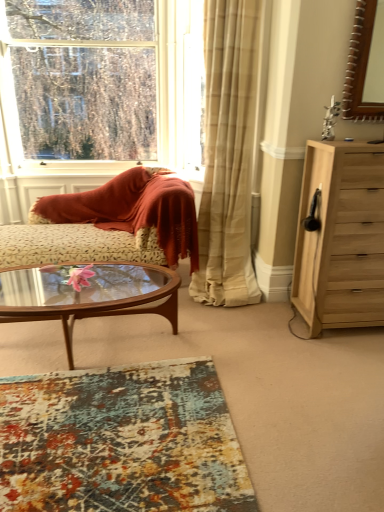
Question: Is textured multicolored rug at lower center next to transparent glass coffee table at center?

Choices:
 (A) no
 (B) yes

Answer: (A)

Question: Is textured multicolored rug at lower center at the left side of transparent glass coffee table at center?

Choices:
 (A) yes
 (B) no

Answer: (B)

Question: From the image's perspective, is textured multicolored rug at lower center beneath transparent glass coffee table at center?

Choices:
 (A) no
 (B) yes

Answer: (B)

Question: Does textured multicolored rug at lower center have a smaller size compared to transparent glass coffee table at center?

Choices:
 (A) yes
 (B) no

Answer: (A)

Question: Considering the relative sizes of textured multicolored rug at lower center and transparent glass coffee table at center in the image provided, is textured multicolored rug at lower center shorter than transparent glass coffee table at center?

Choices:
 (A) yes
 (B) no

Answer: (A)

Question: From a real-world perspective, is floral-patterned fabric couch at center positioned above or below clear glass window at upper left?

Choices:
 (A) below
 (B) above

Answer: (A)

Question: Based on their sizes in the image, would you say floral-patterned fabric couch at center is bigger or smaller than clear glass window at upper left?

Choices:
 (A) big
 (B) small

Answer: (A)

Question: Is floral-patterned fabric couch at center spatially inside clear glass window at upper left, or outside of it?

Choices:
 (A) inside
 (B) outside

Answer: (B)

Question: In terms of width, does floral-patterned fabric couch at center look wider or thinner when compared to clear glass window at upper left?

Choices:
 (A) thin
 (B) wide

Answer: (B)

Question: Is textured multicolored rug at lower center inside the boundaries of transparent glass coffee table at center, or outside?

Choices:
 (A) inside
 (B) outside

Answer: (B)

Question: From a real-world perspective, is textured multicolored rug at lower center physically located above or below transparent glass coffee table at center?

Choices:
 (A) above
 (B) below

Answer: (B)

Question: Is textured multicolored rug at lower center bigger or smaller than transparent glass coffee table at center?

Choices:
 (A) small
 (B) big

Answer: (A)

Question: Is textured multicolored rug at lower center to the left or to the right of transparent glass coffee table at center in the image?

Choices:
 (A) left
 (B) right

Answer: (B)

Question: From the image's perspective, is floral-patterned fabric couch at center above or below beige plaid curtain at center?

Choices:
 (A) below
 (B) above

Answer: (A)

Question: In terms of height, does floral-patterned fabric couch at center look taller or shorter compared to beige plaid curtain at center?

Choices:
 (A) tall
 (B) short

Answer: (B)